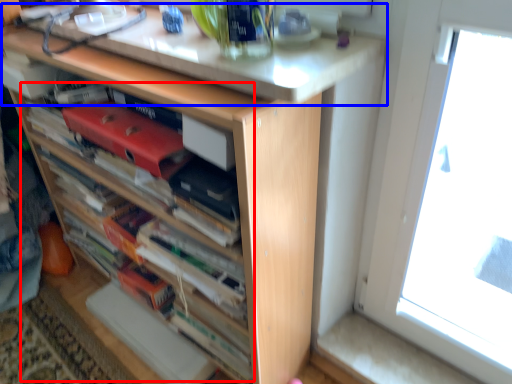
Question: Among these objects, which one is nearest to the camera, book (highlighted by a red box) or counter top (highlighted by a blue box)?

Choices:
 (A) book
 (B) counter top

Answer: (A)